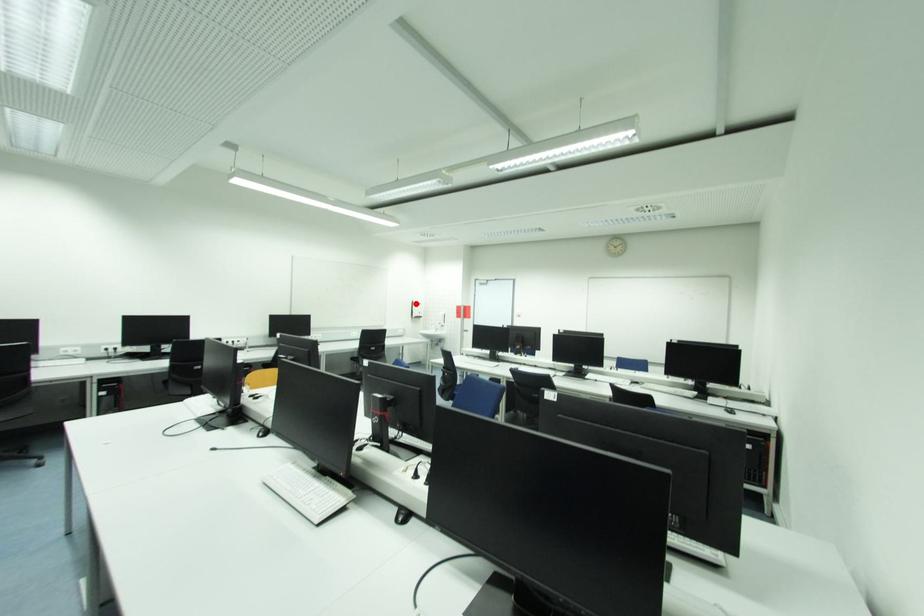
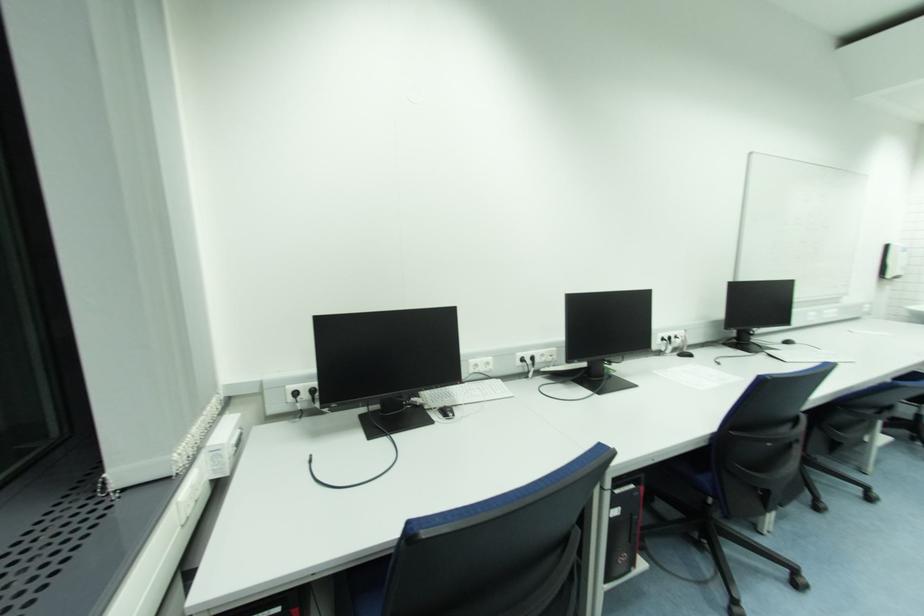
In the second image, find the point that corresponds to the highlighted location in the first image.

(892, 248)